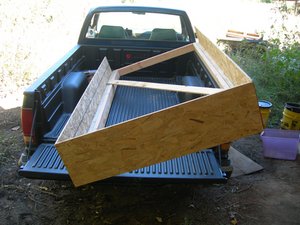
Locate an element on the screen. beams is located at coordinates (163, 88), (102, 116), (218, 74).